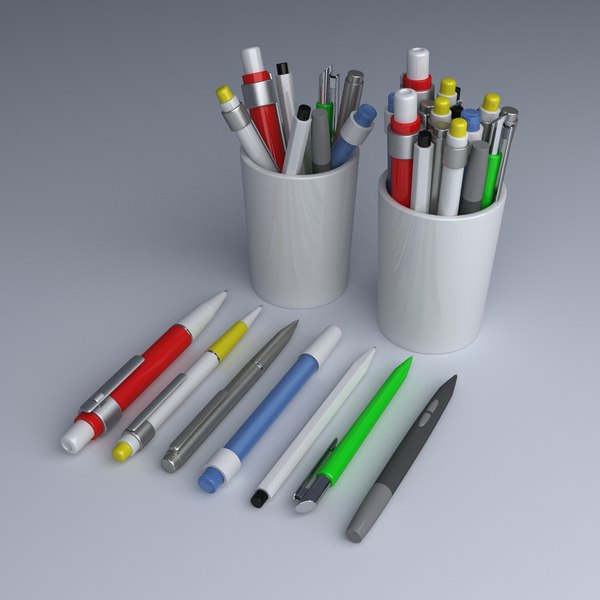
Identify the location of green and  blue pens. (371, 417), (492, 166), (330, 112), (346, 145), (475, 135), (386, 118), (282, 393).